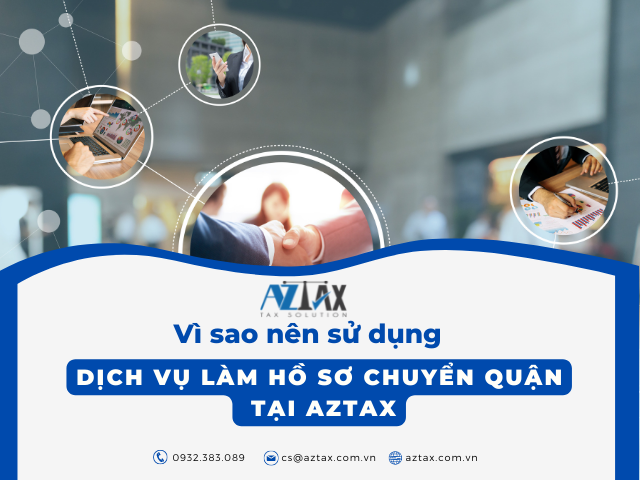
Where is `walls`? This screenshot has width=640, height=480. walls is located at coordinates (281, 121), (516, 83).